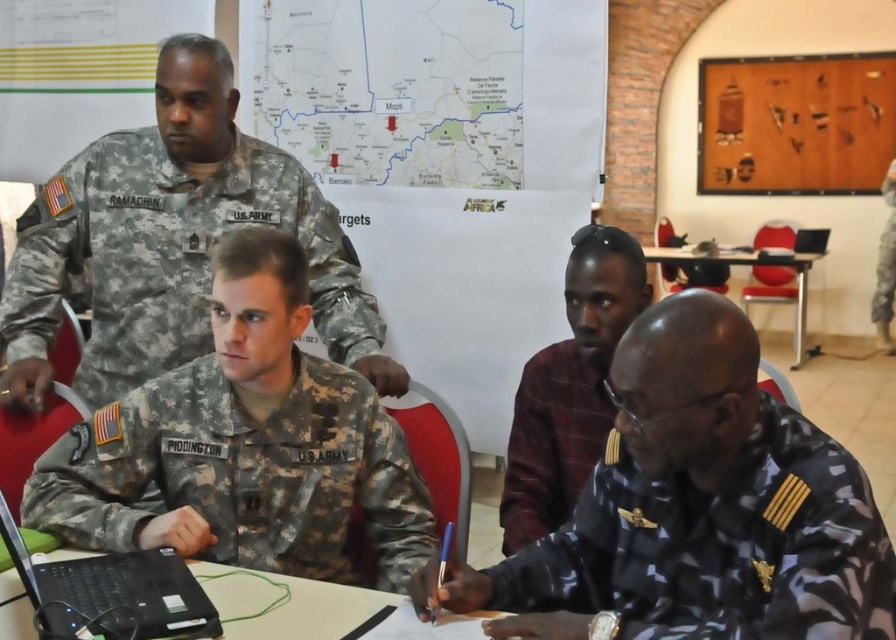
Question: Which of the following is the closest to the observer?

Choices:
 (A) metallic silver table at center
 (B) black plastic table at lower center

Answer: (B)

Question: Can you confirm if camouflage fabric uniform at center is positioned below maroon textured sweater at center?

Choices:
 (A) no
 (B) yes

Answer: (B)

Question: Is camouflage fabric uniform at center positioned at the back of camouflage laptop at lower left?

Choices:
 (A) no
 (B) yes

Answer: (B)

Question: Which of the following is the closest to the observer?

Choices:
 (A) camouflage laptop at lower left
 (B) camouflage fabric uniform at center
 (C) navy blue fabric uniform at lower right
 (D) black plastic table at lower center

Answer: (A)

Question: From the image, what is the correct spatial relationship of maroon textured sweater at center in relation to navy blue fabric uniform at lower right?

Choices:
 (A) left
 (B) right

Answer: (B)

Question: Which object is positioned closest to the camouflage fabric uniform at center?

Choices:
 (A) metallic silver table at center
 (B) navy blue fabric uniform at lower right
 (C) camouflage fabric uniform at upper left
 (D) camouflage fabric uniform at lower right

Answer: (B)